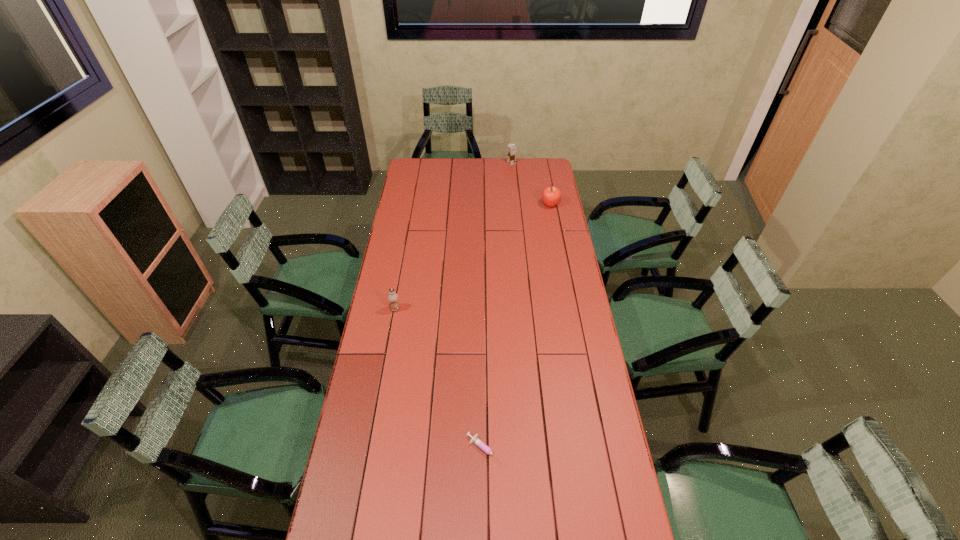
Identify the location of free region located 0.220m on the left of the apple. (500, 205).

Where is `vacant space located 0.270m on the left of the shortest object`? Image resolution: width=960 pixels, height=540 pixels. vacant space located 0.270m on the left of the shortest object is located at coordinates (383, 450).

Where is `object situated at the far edge`? The image size is (960, 540). object situated at the far edge is located at coordinates (511, 149).

What are the coordinates of `object situated at the left edge` in the screenshot? It's located at (392, 297).

You are a GUI agent. You are given a task and a screenshot of the screen. Output one action in this format:
    pyautogui.click(x=<x>, y=<y>)
    Task: Click on the object at the right edge
    This screenshot has height=540, width=960.
    Given the screenshot: What is the action you would take?
    pyautogui.click(x=551, y=195)

In the image, there is a desktop. At what (x,y) coordinates should I click in order to perform the action: click on vacant space at the far edge. Please return your answer as a coordinate pair (x, y). The height and width of the screenshot is (540, 960). Looking at the image, I should click on (498, 159).

What are the coordinates of `vacant space at the left edge` in the screenshot? It's located at (403, 206).

Find the location of `vacant space at the right edge`. vacant space at the right edge is located at coordinates (588, 420).

Identify the location of vacant area between the third object from right to left and the second farthest object. (517, 327).

In order to click on free spot between the second object from right to left and the syringe in this screenshot , I will do `click(498, 306)`.